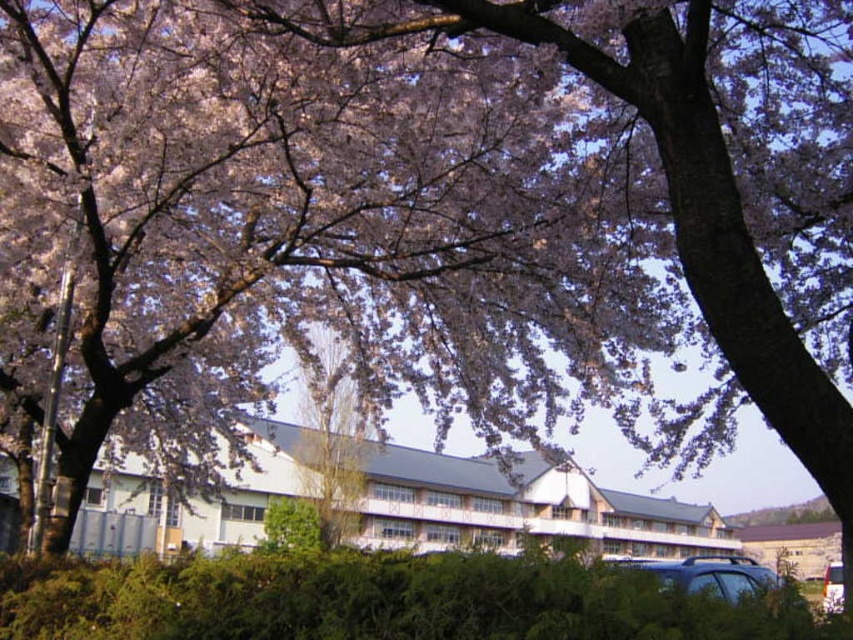
You are standing at the center of the cherry blossom area and want to walk towards the building. There are two points marked on the path. Which point, point (711, 563) or point (830, 566), is closer to you as you face the building?

Point (711, 563) is closer to you because it is in front of point (830, 566).

You are a gardener planning to trim the green leafy hedge at lower center and the white glossy van at lower right. Which object requires more time to trim due to its size?

The white glossy van at lower right requires more time to trim because it is thicker than the green leafy hedge at lower center.

You are standing at the entrance of the school and see the green leafy hedge at lower center and the matte black car at lower right. Which object is closer to you?

The green leafy hedge at lower center is positioned over the matte black car at lower right, so the green leafy hedge at lower center is closer to you.